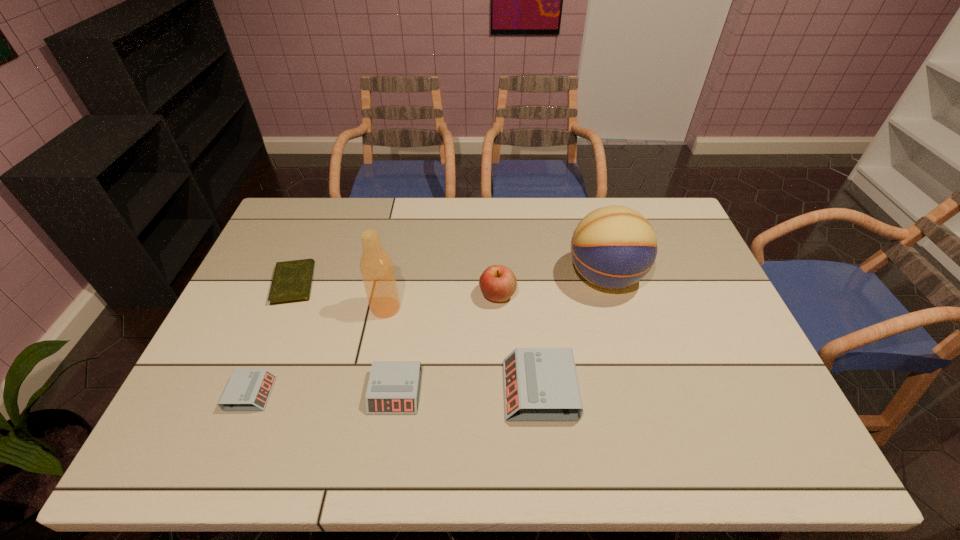
Choose which alarm clock is the second nearest neighbor to the shortest object. Please provide its 2D coordinates. Your answer should be formatted as a tuple, i.e. [(x, y)], where the tuple contains the x and y coordinates of a point satisfying the conditions above.

[(394, 386)]

Where is `free space that satisfies the following two spatial constraints: 1. on the back side of the beer bottle; 2. on the left side of the apple`? Image resolution: width=960 pixels, height=540 pixels. free space that satisfies the following two spatial constraints: 1. on the back side of the beer bottle; 2. on the left side of the apple is located at coordinates (388, 295).